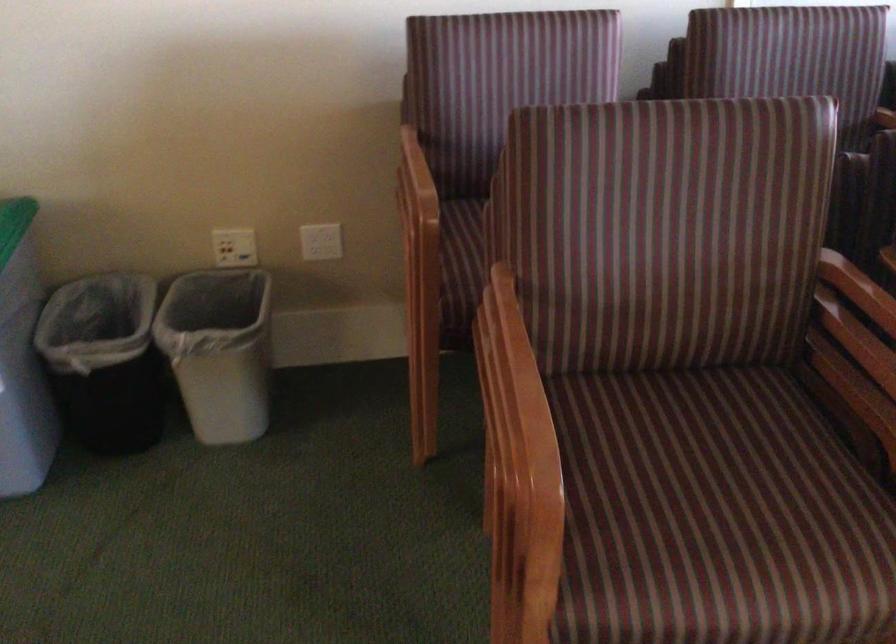
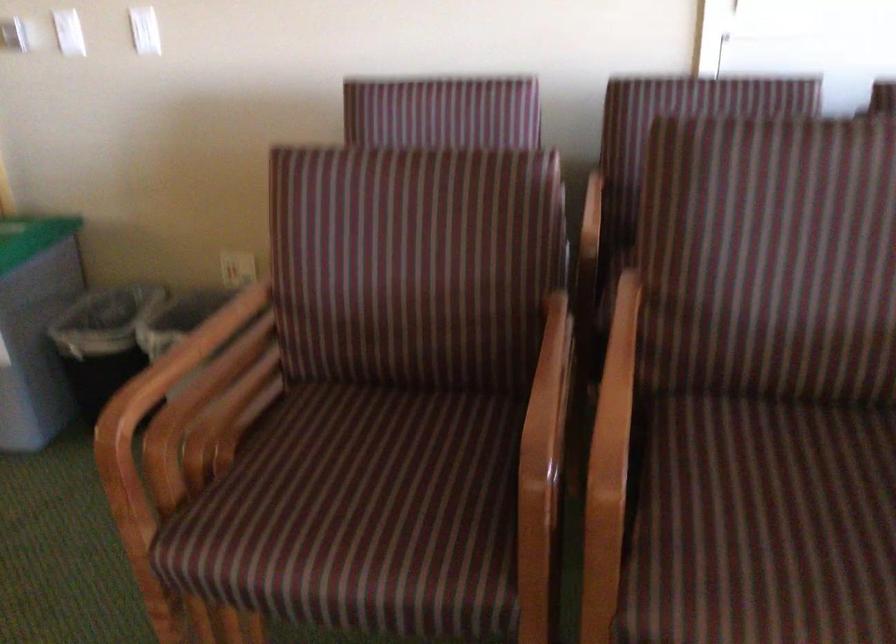
Question: The images are taken continuously from a first-person perspective. In which direction are you moving?

Choices:
 (A) Left
 (B) Right
 (C) Forward
 (D) Backward

Answer: (B)